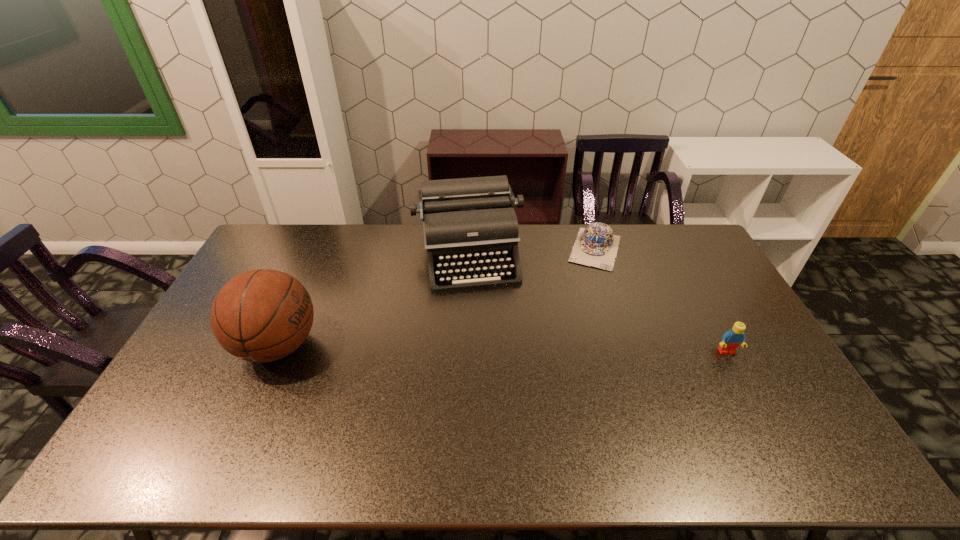
Locate an element on the screen. This screenshot has height=540, width=960. basketball is located at coordinates (263, 315).

The image size is (960, 540). What are the coordinates of `the third tallest object` in the screenshot? It's located at (734, 337).

At what (x,y) coordinates should I click in order to perform the action: click on Lego. Please return your answer as a coordinate pair (x, y). The width and height of the screenshot is (960, 540). Looking at the image, I should click on (734, 337).

Locate an element on the screen. This screenshot has height=540, width=960. the second object from left to right is located at coordinates (470, 225).

Where is `the third object from left to right`? the third object from left to right is located at coordinates (596, 246).

You are a GUI agent. You are given a task and a screenshot of the screen. Output one action in this format:
    pyautogui.click(x=<x>, y=<y>)
    Task: Click on the shortest object
    This screenshot has height=540, width=960.
    Given the screenshot: What is the action you would take?
    pyautogui.click(x=596, y=246)

What are the coordinates of `free location located 0.260m on the side with brand label of the basketball` in the screenshot? It's located at (408, 346).

Image resolution: width=960 pixels, height=540 pixels. Find the location of `blank space located on the face of the second shortest object`. blank space located on the face of the second shortest object is located at coordinates (747, 388).

The image size is (960, 540). Identify the location of free region located on the typing side of the typewriter. (480, 322).

You are a GUI agent. You are given a task and a screenshot of the screen. Output one action in this format:
    pyautogui.click(x=<x>, y=<y>)
    Task: Click on the free space located 0.310m on the typing side of the typewriter
    
    Given the screenshot: What is the action you would take?
    pyautogui.click(x=489, y=366)